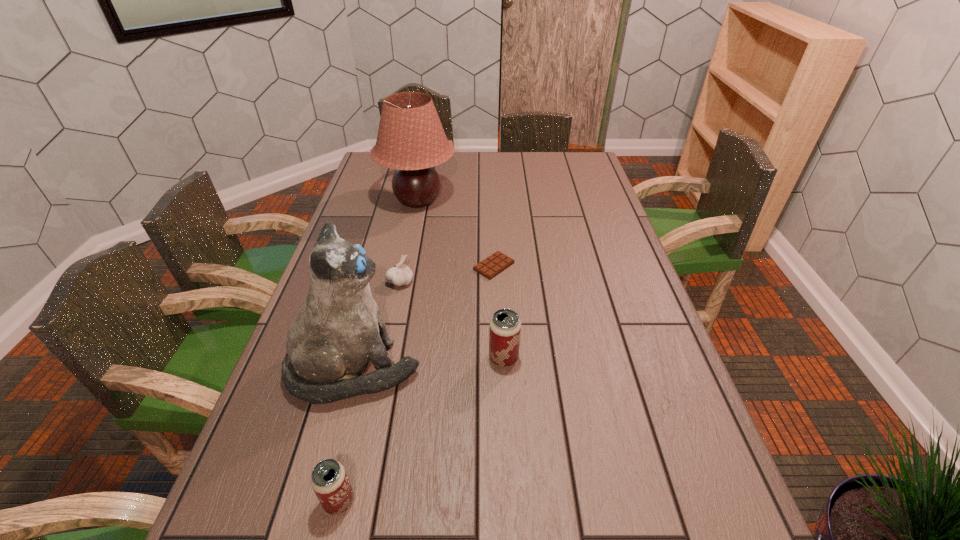
Identify the location of free space that satisfies the following two spatial constraints: 1. on the back side of the fifth tallest object; 2. on the right side of the nearest object. (390, 282).

Find the location of `free location that satisfies the following two spatial constraints: 1. on the back side of the second shortest object; 2. on the left side of the nearer beer can`. free location that satisfies the following two spatial constraints: 1. on the back side of the second shortest object; 2. on the left side of the nearer beer can is located at coordinates (390, 282).

Identify the location of vacant space that satisfies the following two spatial constraints: 1. on the back side of the nearer beer can; 2. at the face of the cat. The width and height of the screenshot is (960, 540). (370, 369).

Identify the location of vacant area in the image that satisfies the following two spatial constraints: 1. on the front-facing side of the lampshade; 2. on the front side of the garlic. This screenshot has width=960, height=540. (401, 282).